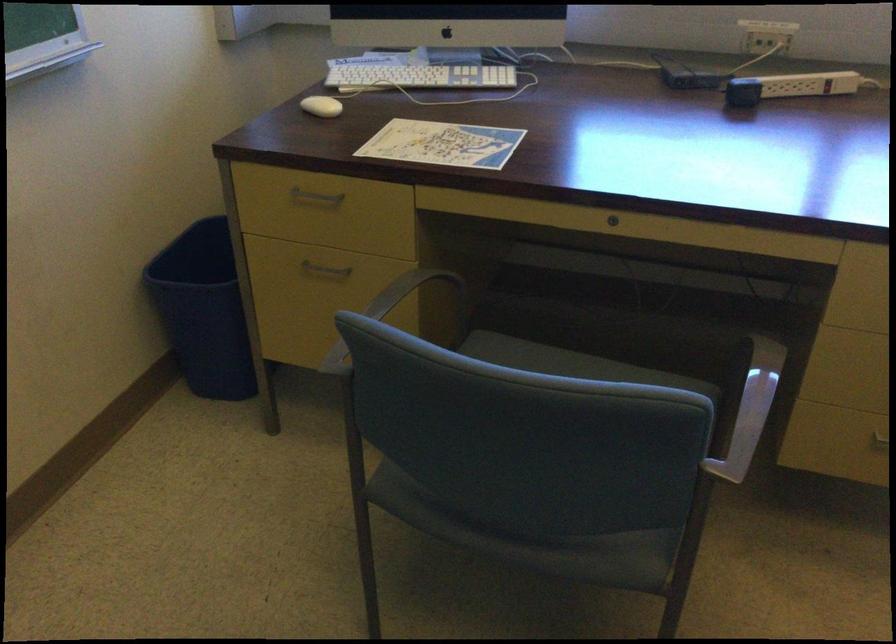
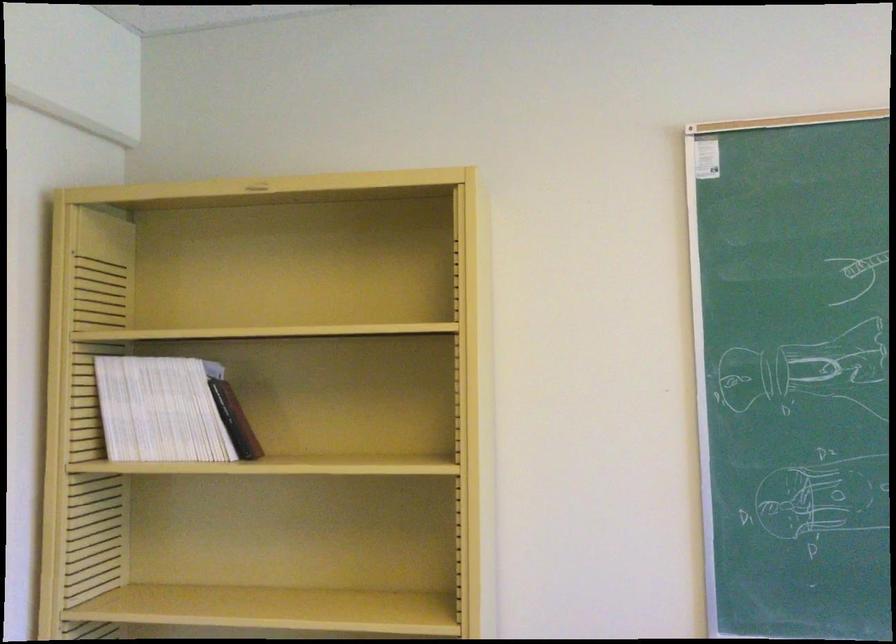
Question: The images are taken continuously from a first-person perspective. In which direction is your viewpoint rotating?

Choices:
 (A) Left
 (B) Right
 (C) Up
 (D) Down

Answer: (A)